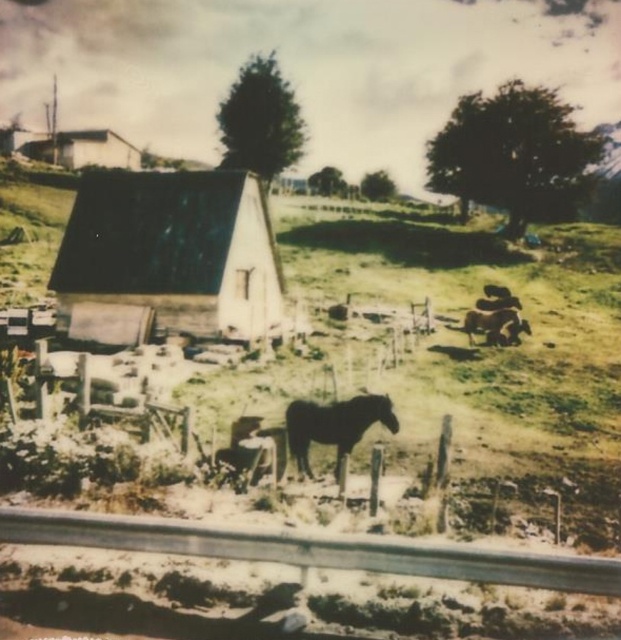
Is wooden hut at center in front of dark brown horse at center?

No.

Identify the location of wooden hut at center. This screenshot has height=640, width=621. (168, 257).

The image size is (621, 640). Find the location of `wooden hut at center`. wooden hut at center is located at coordinates (168, 257).